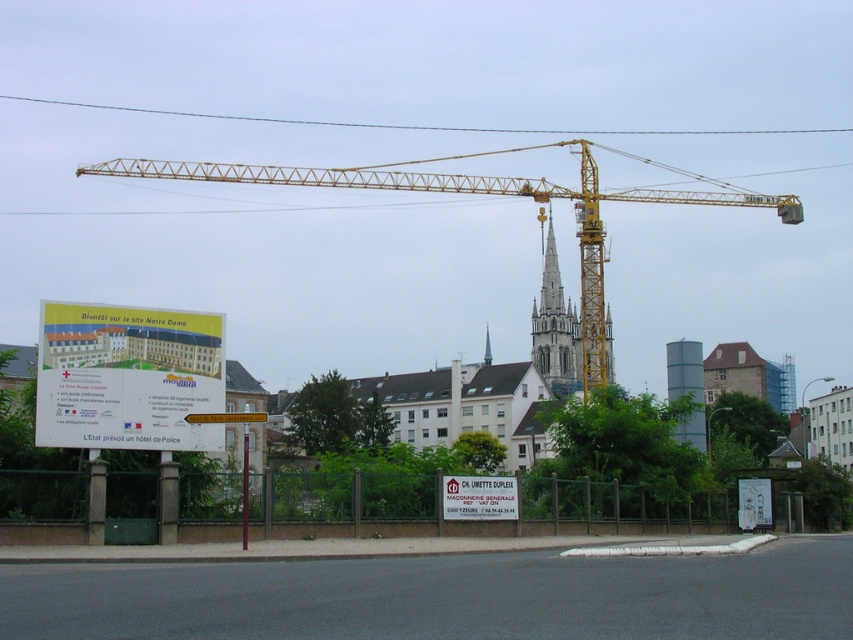
Question: Is the position of white paper sign at lower left less distant than that of white plastic street sign at center?

Choices:
 (A) yes
 (B) no

Answer: (A)

Question: Which point is closer to the camera?

Choices:
 (A) (134, 326)
 (B) (552, 305)
 (C) (234, 413)
 (D) (457, 476)

Answer: (C)

Question: Among these objects, which one is nearest to the camera?

Choices:
 (A) white paper sign at lower left
 (B) green metallic tank at center
 (C) smooth gray steeple at center
 (D) white plastic sign at center

Answer: (A)

Question: Is white paper sign at lower left positioned before white plastic sign at center?

Choices:
 (A) no
 (B) yes

Answer: (B)

Question: Estimate the real-world distances between objects in this image. Which object is farther from the green metallic tank at center?

Choices:
 (A) polished stone spire at center
 (B) white paper sign at lower left

Answer: (A)

Question: Observing the image, what is the correct spatial positioning of polished stone spire at center in reference to smooth gray steeple at center?

Choices:
 (A) right
 (B) left

Answer: (A)